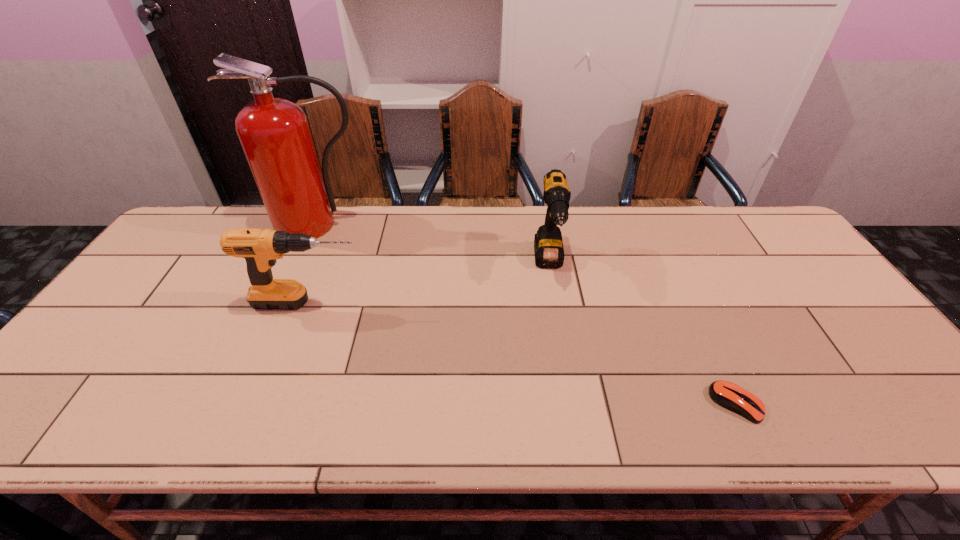
The width and height of the screenshot is (960, 540). Identify the location of free area in between the fire extinguisher and the farther drill. (434, 244).

At what (x,y) coordinates should I click in order to perform the action: click on free area in between the tallest object and the third farthest object. Please return your answer as a coordinate pair (x, y). Looking at the image, I should click on (314, 264).

Locate an element on the screen. free space between the third farthest object and the tallest object is located at coordinates (314, 264).

Identify the location of unoccupied position between the computer mouse and the tallest object. (527, 314).

Where is `free space between the left drill and the computer mouse`? free space between the left drill and the computer mouse is located at coordinates (522, 353).

At what (x,y) coordinates should I click in order to perform the action: click on vacant space that's between the fire extinguisher and the farther drill. Please return your answer as a coordinate pair (x, y). This screenshot has width=960, height=540. Looking at the image, I should click on (434, 244).

Where is `free space that is in between the farther drill and the third farthest object`? free space that is in between the farther drill and the third farthest object is located at coordinates (429, 284).

Where is `free area in between the nearest object and the nearer drill`? This screenshot has width=960, height=540. free area in between the nearest object and the nearer drill is located at coordinates (522, 353).

Choose which object is the second nearest neighbor to the fire extinguisher. Please provide its 2D coordinates. Your answer should be formatted as a tuple, i.e. [(x, y)], where the tuple contains the x and y coordinates of a point satisfying the conditions above.

[(548, 246)]

Locate which object is the second closest to the third farthest object. Please provide its 2D coordinates. Your answer should be formatted as a tuple, i.e. [(x, y)], where the tuple contains the x and y coordinates of a point satisfying the conditions above.

[(548, 246)]